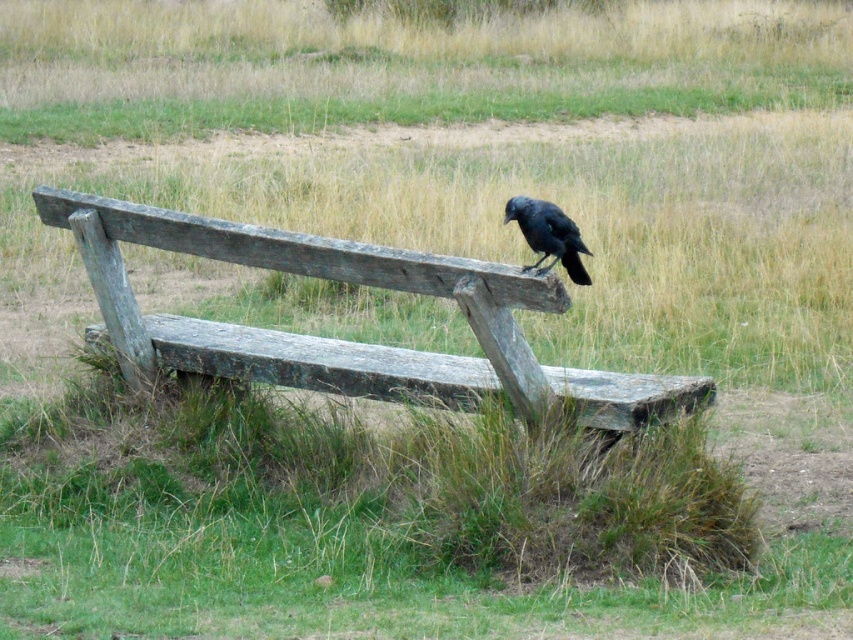
You are standing in front of the bench and want to place a small item on the closest point between point (192, 353) and point (567, 227). Which point should you choose?

Point (192, 353) is closer to you than point (567, 227), so you should place the item on point (192, 353).

You are a painter wanting to paint this scene. You need to know if the weathered wood bench at center is wider than the shiny black raven at upper center to decide your canvas size. Can you tell me?

The weathered wood bench at center is wider than the shiny black raven at upper center according to the description.